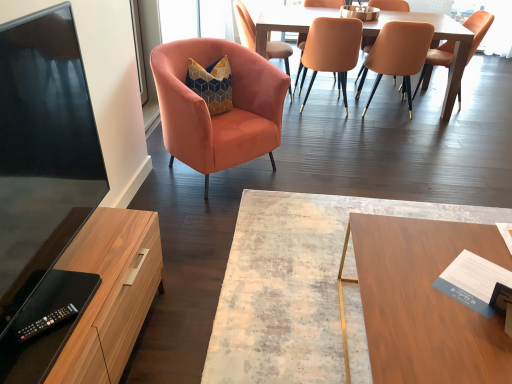
You are a GUI agent. You are given a task and a screenshot of the screen. Output one action in this format:
    pyautogui.click(x=<x>, y=<y>)
    Task: Click on the free space in front of matte orange chair at upper right, the 6th chair in the left-to-right sequence
    This screenshot has height=384, width=512.
    Given the screenshot: What is the action you would take?
    pyautogui.click(x=434, y=115)